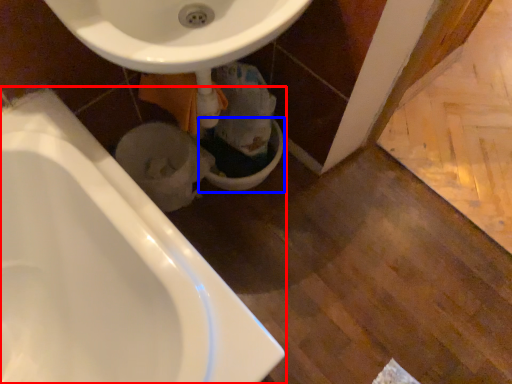
Question: Which point is closer to the camera, bathtub (highlighted by a red box) or toilet bowl (highlighted by a blue box)?

Choices:
 (A) bathtub
 (B) toilet bowl

Answer: (A)